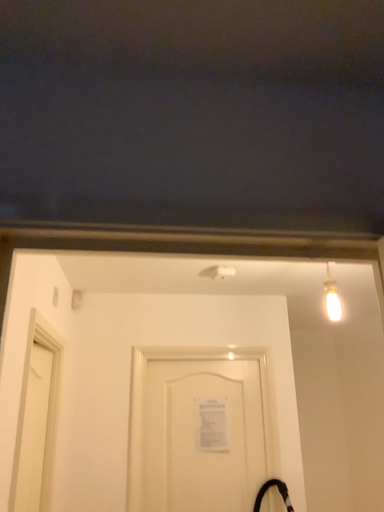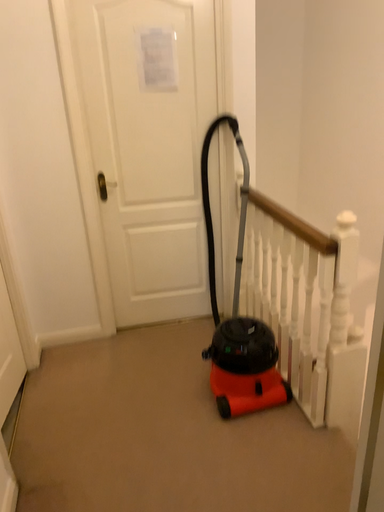
Question: How did the camera likely rotate when shooting the video?

Choices:
 (A) rotated upward
 (B) rotated downward

Answer: (B)